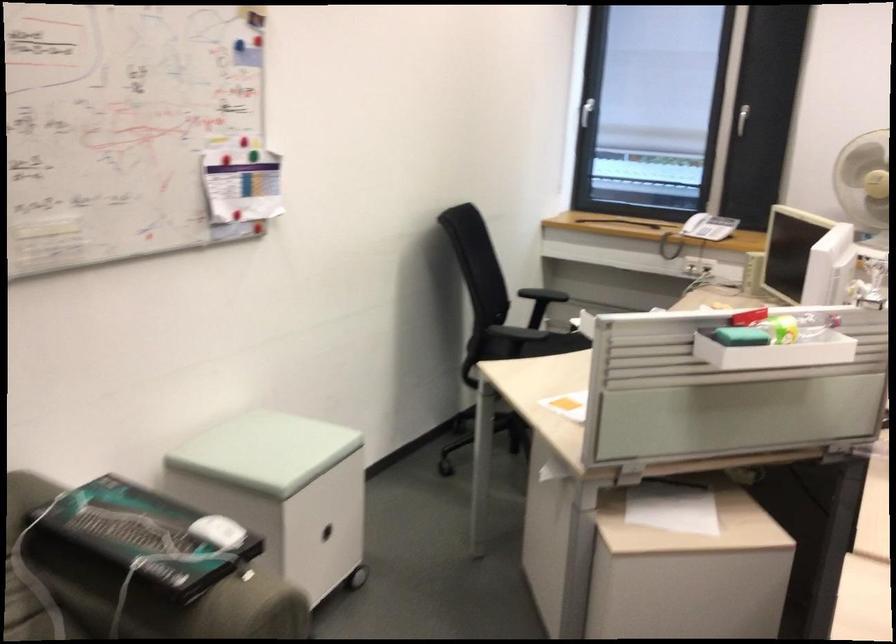
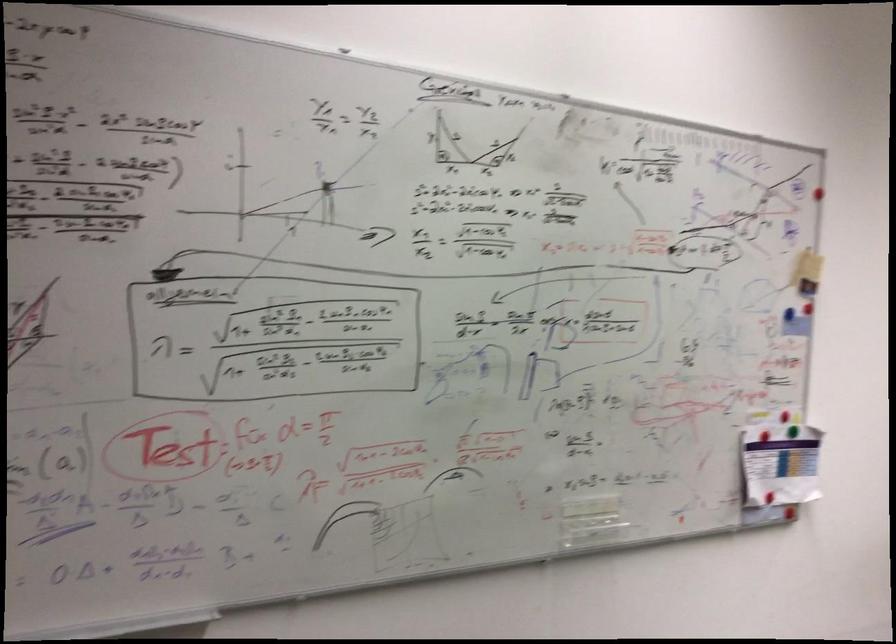
Question: The camera is either moving clockwise (left) or counter-clockwise (right) around the object. The first image is from the beginning of the video and the second image is from the end. Is the camera moving left or right when shooting the video?

Choices:
 (A) Left
 (B) Right

Answer: (B)